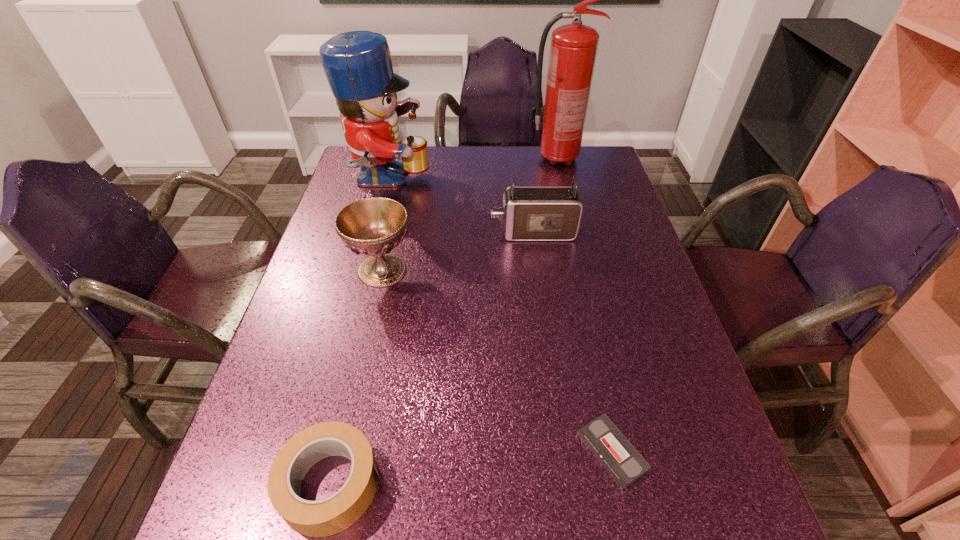
At what (x,y) coordinates should I click in order to perform the action: click on videotape that is at the right edge. Please return your answer as a coordinate pair (x, y). This screenshot has height=540, width=960. Looking at the image, I should click on (621, 460).

This screenshot has width=960, height=540. I want to click on object that is positioned at the far left corner, so click(x=358, y=66).

Identify the location of object located in the near left corner section of the desktop. (334, 514).

Identify the location of object that is at the far right corner. This screenshot has height=540, width=960. (573, 50).

In the image, there is a desktop. Where is `blank space at the near edge`? This screenshot has width=960, height=540. blank space at the near edge is located at coordinates (631, 537).

You are a GUI agent. You are given a task and a screenshot of the screen. Output one action in this format:
    pyautogui.click(x=<x>, y=<y>)
    Task: Click on the vacant area at the left edge
    The height and width of the screenshot is (540, 960).
    Given the screenshot: What is the action you would take?
    pyautogui.click(x=330, y=318)

Find the location of `vacant space at the right edge of the desktop`. vacant space at the right edge of the desktop is located at coordinates (626, 216).

At what (x,y) coordinates should I click in order to perform the action: click on free space between the fifth tallest object and the fourth farthest object. Please return your answer as a coordinate pair (x, y). The height and width of the screenshot is (540, 960). Looking at the image, I should click on (358, 377).

Identify the location of free area in between the chalice and the videotape. (497, 361).

This screenshot has height=540, width=960. Identify the location of free space between the videotape and the third farthest object. (572, 342).